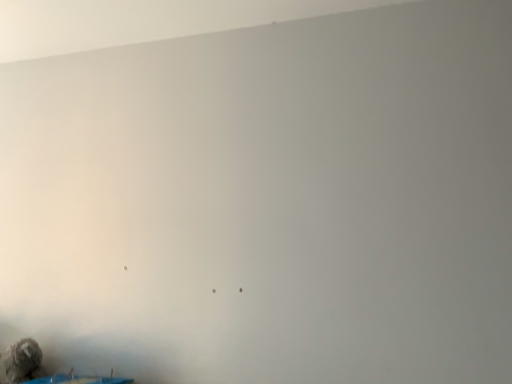
What do you see at coordinates (78, 379) in the screenshot? I see `blue plastic table at lower left` at bounding box center [78, 379].

What is the approximate height of blue plastic table at lower left?

8.56 centimeters.

The image size is (512, 384). Identify the location of blue plastic table at lower left. (78, 379).

In order to click on blue plastic table at lower left in this screenshot , I will do `click(78, 379)`.